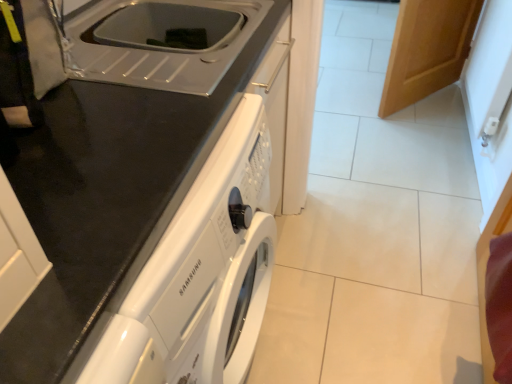
At what (x,y) coordinates should I click in order to perform the action: click on blank area beneath wooden door at upper right (from a real-world perspective). Please return your answer as a coordinate pair (x, y). Image resolution: width=512 pixels, height=384 pixels. Looking at the image, I should click on (424, 100).